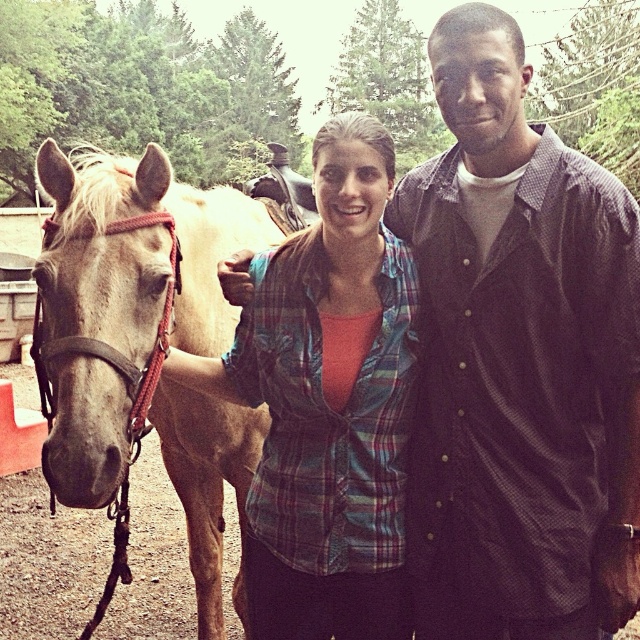
Question: Which of the following is the closest to the observer?

Choices:
 (A) (92, 211)
 (B) (477, 257)
 (C) (321, 621)

Answer: (A)

Question: Which of the following is the closest to the observer?

Choices:
 (A) (282, 202)
 (B) (339, 266)

Answer: (B)

Question: Is dark brown button-up shirt at center-right wider than light brown horse at left?

Choices:
 (A) no
 (B) yes

Answer: (A)

Question: Can you confirm if dark brown button-up shirt at center-right is positioned to the left of plaid shirt at center?

Choices:
 (A) yes
 (B) no

Answer: (B)

Question: Does dark brown button-up shirt at center-right have a smaller size compared to plaid shirt at center?

Choices:
 (A) yes
 (B) no

Answer: (B)

Question: Among these points, which one is nearest to the camera?

Choices:
 (A) (307, 285)
 (B) (205, 572)

Answer: (A)